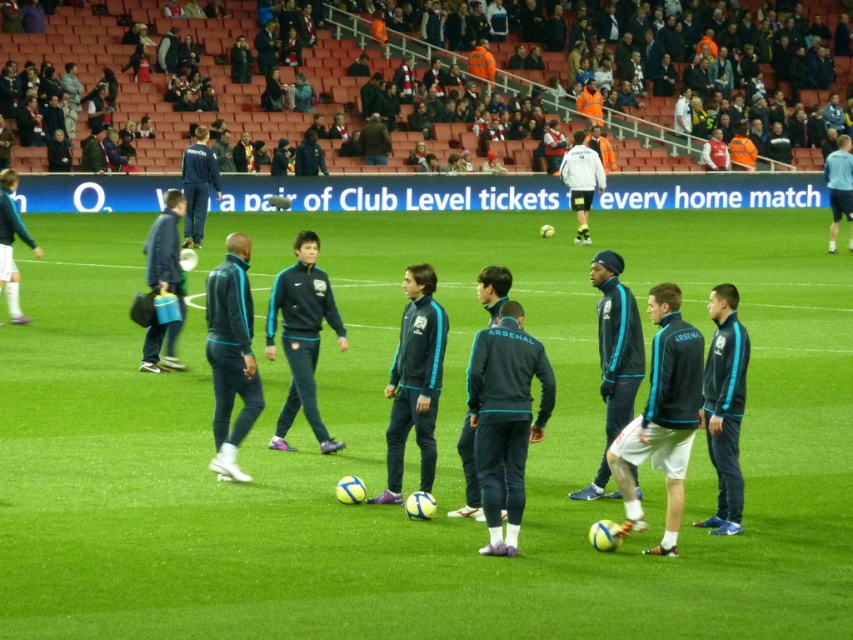
How much distance is there between dark blue fabric jacket at center and leather jacket at center?

dark blue fabric jacket at center is 4.52 feet away from leather jacket at center.

Based on the photo, can you confirm if dark blue fabric jacket at center is positioned to the left of leather jacket at center?

Incorrect, dark blue fabric jacket at center is not on the left side of leather jacket at center.

Describe the element at coordinates (415, 380) in the screenshot. The width and height of the screenshot is (853, 640). I see `dark blue fabric jacket at center` at that location.

I want to click on dark blue fabric jacket at center, so [415, 380].

Does blue fabric jacket at left appear under white matte jacket at center?

Yes.

Is point (178, 246) positioned before point (592, 172)?

That is True.

Find the location of a particular element. This screenshot has height=640, width=853. blue fabric jacket at left is located at coordinates (164, 282).

Is dark blue tracksuit at center taller than light blue fabric jacket at upper right?

No.

Does point (194, 173) come behind point (846, 212)?

That is False.

Is point (189, 205) less distant than point (842, 164)?

Yes, point (189, 205) is closer to viewer.

In order to click on dark blue tracksuit at center in this screenshot , I will do `click(196, 186)`.